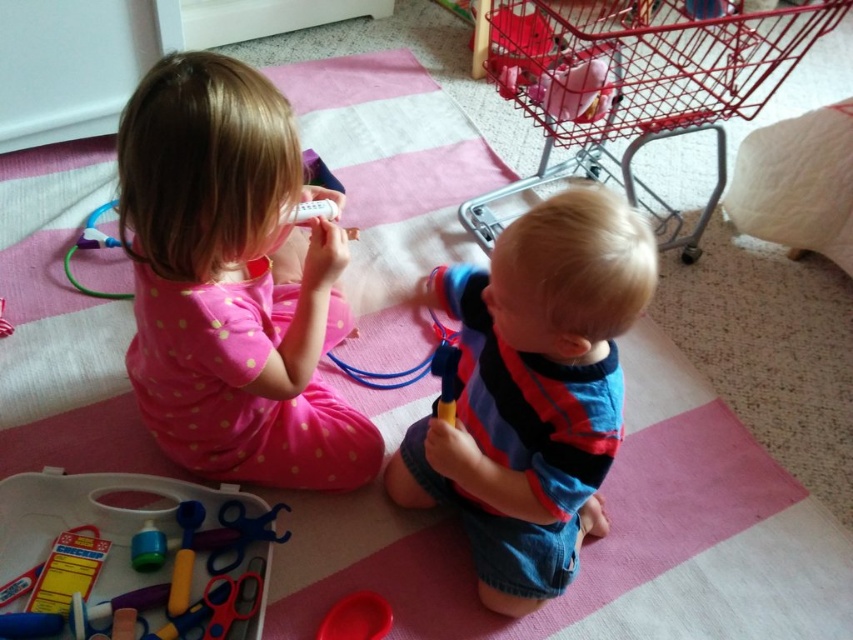
Question: Among these objects, which one is farthest from the camera?

Choices:
 (A) pink polka dot pajamas at upper left
 (B) red wire shopping cart at upper right
 (C) rubber red bowl at lower center
 (D) striped cotton shirt at center

Answer: (B)

Question: Among these points, which one is farthest from the camera?

Choices:
 (A) (235, 596)
 (B) (383, 602)
 (C) (198, 408)
 (D) (836, 19)

Answer: (D)

Question: In this image, where is striped cotton shirt at center located relative to metallic silver scissors at lower left?

Choices:
 (A) left
 (B) right

Answer: (B)

Question: Where is pink polka dot pajamas at upper left located in relation to striped cotton shirt at center in the image?

Choices:
 (A) right
 (B) left

Answer: (B)

Question: Is plastic scissors at lower left bigger than rubberized plastic toy at lower center?

Choices:
 (A) no
 (B) yes

Answer: (B)

Question: Which point is farther to the camera?

Choices:
 (A) rubber red bowl at lower center
 (B) plastic scissors at lower left
 (C) striped cotton shirt at center

Answer: (A)